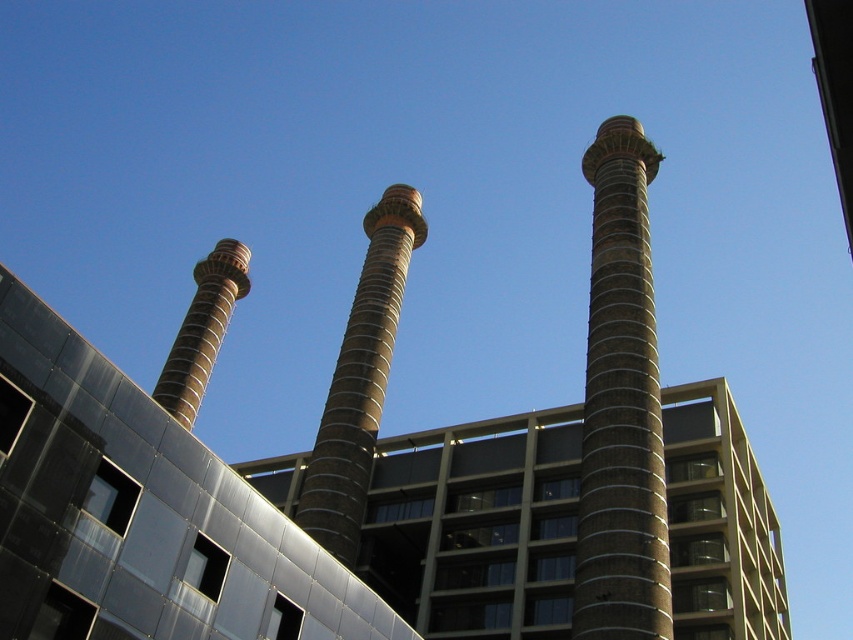
Does point (413, 241) lie in front of point (195, 328)?

Yes, point (413, 241) is in front of point (195, 328).

Is brown textured tower at center wider than brown textured chimney at left?

Yes, brown textured tower at center is wider than brown textured chimney at left.

Find the location of `brown textured tower at center`. brown textured tower at center is located at coordinates (360, 380).

Is point (621, 147) positioned after point (325, 492)?

Yes, it is.

The image size is (853, 640). Describe the element at coordinates (621, 406) in the screenshot. I see `brown concrete pillar at right` at that location.

What do you see at coordinates (621, 406) in the screenshot? I see `brown concrete pillar at right` at bounding box center [621, 406].

Identify the location of brown concrete pillar at right. (621, 406).

Between brown concrete pillar at right and brown textured chimney at left, which one is positioned lower?

Positioned lower is brown concrete pillar at right.

Measure the distance from brown concrete pillar at right to brown textured chimney at left.

brown concrete pillar at right is 46.29 meters away from brown textured chimney at left.

Between point (670, 637) and point (238, 268), which one is positioned behind?

The point (238, 268) is behind.

Locate an element on the screen. The width and height of the screenshot is (853, 640). brown concrete pillar at right is located at coordinates (621, 406).